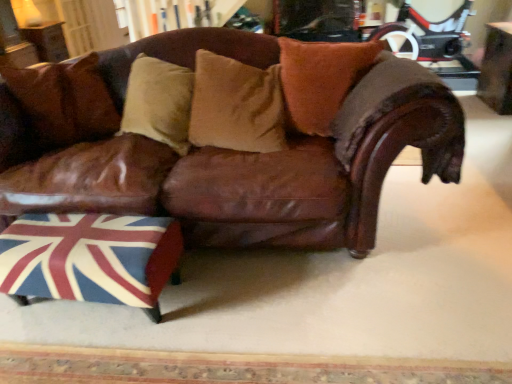
Question: Are wooden table at upper left, arranged as the 1th table when viewed from the top, and wooden table at upper right, the 2th table from the back, far apart?

Choices:
 (A) yes
 (B) no

Answer: (A)

Question: Does wooden table at upper left, the 2th table in the bottom-to-top sequence, have a larger size compared to wooden table at upper right, positioned as the 1th table in front-to-back order?

Choices:
 (A) no
 (B) yes

Answer: (A)

Question: Does wooden table at upper left, the first table from the left, have a greater height compared to wooden table at upper right, the 2th table from the back?

Choices:
 (A) yes
 (B) no

Answer: (B)

Question: Does wooden table at upper left, acting as the 2th table starting from the right, come behind wooden table at upper right, positioned as the 1th table in front-to-back order?

Choices:
 (A) yes
 (B) no

Answer: (A)

Question: Is wooden table at upper left, the first table from the left, shorter than wooden table at upper right, the 2th table from the back?

Choices:
 (A) no
 (B) yes

Answer: (B)

Question: From a real-world perspective, is brown leather couch at center positioned above or below wooden table at upper left, which is the first table from back to front?

Choices:
 (A) below
 (B) above

Answer: (A)

Question: Is brown leather couch at center inside the boundaries of wooden table at upper left, acting as the 2th table starting from the right, or outside?

Choices:
 (A) outside
 (B) inside

Answer: (A)

Question: Is brown leather couch at center in front of or behind wooden table at upper left, arranged as the 1th table when viewed from the top, in the image?

Choices:
 (A) behind
 (B) front

Answer: (B)

Question: In terms of size, does brown leather couch at center appear bigger or smaller than wooden table at upper left, arranged as the 1th table when viewed from the top?

Choices:
 (A) big
 (B) small

Answer: (A)

Question: Looking at the image, does brown leather couch at center seem bigger or smaller compared to wooden table at upper right, which ranks as the 1th table in right-to-left order?

Choices:
 (A) small
 (B) big

Answer: (B)

Question: Is brown leather couch at center inside the boundaries of wooden table at upper right, the 2th table positioned from the top, or outside?

Choices:
 (A) inside
 (B) outside

Answer: (B)

Question: Relative to wooden table at upper right, the 2th table from the back, is brown leather couch at center in front or behind?

Choices:
 (A) front
 (B) behind

Answer: (A)

Question: Does point (436, 170) appear closer or farther from the camera than point (506, 81)?

Choices:
 (A) closer
 (B) farther

Answer: (A)

Question: Considering the positions of point (27, 39) and point (356, 44), is point (27, 39) closer or farther from the camera than point (356, 44)?

Choices:
 (A) closer
 (B) farther

Answer: (B)

Question: In terms of height, does wooden table at upper left, which is the first table from back to front, look taller or shorter compared to brown suede pillow at center, marked as the 1th pillow in a right-to-left arrangement?

Choices:
 (A) tall
 (B) short

Answer: (B)